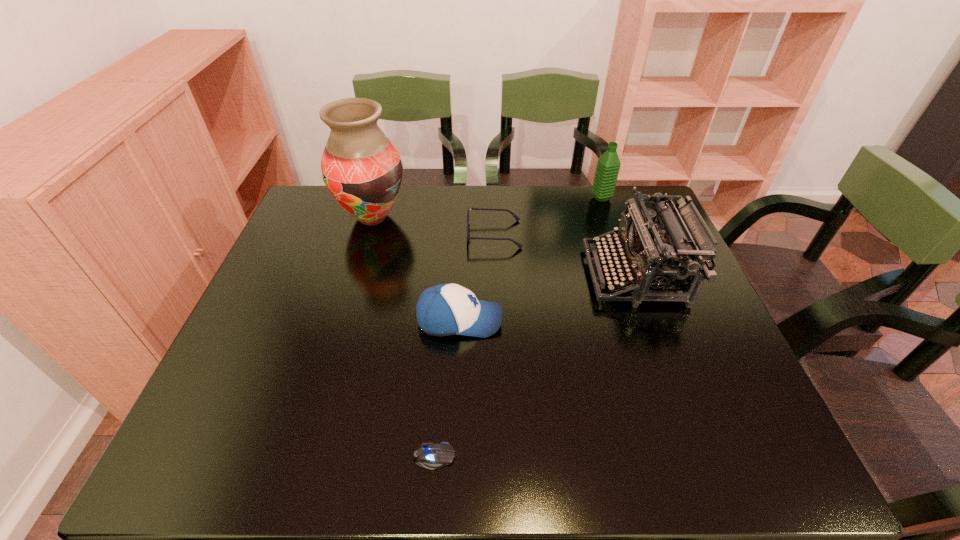
Identify the location of blank space located 0.100m on the typing side of the typewriter. (550, 275).

Where is `vacant region located on the typing side of the typewriter`? The height and width of the screenshot is (540, 960). vacant region located on the typing side of the typewriter is located at coordinates (446, 275).

This screenshot has height=540, width=960. What are the coordinates of `free spot located 0.290m on the typing side of the typewriter` in the screenshot? It's located at (480, 275).

At what (x,y) coordinates should I click in order to perform the action: click on free space located on the front-facing side of the fourth tallest object. Please return your answer as a coordinate pair (x, y). Looking at the image, I should click on (621, 320).

What are the coordinates of `free spot located 0.220m on the front-facing side of the fifth tallest object` in the screenshot? It's located at (393, 234).

The width and height of the screenshot is (960, 540). I want to click on free space located 0.190m on the front-facing side of the fifth tallest object, so click(403, 234).

You are a GUI agent. You are given a task and a screenshot of the screen. Output one action in this format:
    pyautogui.click(x=<x>, y=<y>)
    Task: Click on the free location located 0.280m on the front-facing side of the fifth tallest object
    This screenshot has height=540, width=960.
    Given the screenshot: What is the action you would take?
    pyautogui.click(x=372, y=234)

Image resolution: width=960 pixels, height=540 pixels. What are the coordinates of `free space located 0.290m on the button side of the shortest object` in the screenshot? It's located at (609, 457).

You are a GUI agent. You are given a task and a screenshot of the screen. Output one action in this format:
    pyautogui.click(x=<x>, y=<y>)
    Task: Click on the vase that is at the far edge
    This screenshot has width=960, height=540.
    Given the screenshot: What is the action you would take?
    pyautogui.click(x=361, y=168)

In order to click on water bottle that is at the far edge in this screenshot , I will do `click(608, 165)`.